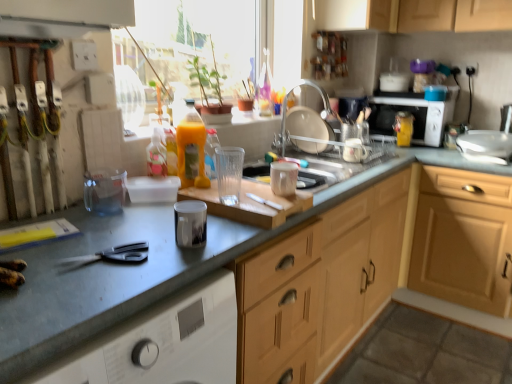
Question: Is the position of translucent plastic bottle at center, acting as the second bottle starting from the front, less distant than that of translucent plastic bottle at center, positioned as the 1th bottle in left-to-right order?

Choices:
 (A) yes
 (B) no

Answer: (B)

Question: From a real-world perspective, is translucent plastic bottle at center, which appears as the 2th bottle when viewed from the back, located beneath translucent plastic bottle at center, the first bottle positioned from the front?

Choices:
 (A) yes
 (B) no

Answer: (A)

Question: From a real-world perspective, is translucent plastic bottle at center, the second bottle from the right, on top of translucent plastic bottle at center, placed as the 3th bottle when sorted from back to front?

Choices:
 (A) no
 (B) yes

Answer: (A)

Question: Is translucent plastic bottle at center, acting as the second bottle starting from the front, to the left of translucent plastic bottle at center, positioned as the 1th bottle in left-to-right order, from the viewer's perspective?

Choices:
 (A) yes
 (B) no

Answer: (B)

Question: Considering the relative positions of translucent plastic bottle at center, acting as the second bottle starting from the front, and translucent plastic bottle at center, positioned as the 1th bottle in left-to-right order, in the image provided, is translucent plastic bottle at center, acting as the second bottle starting from the front, to the right of translucent plastic bottle at center, positioned as the 1th bottle in left-to-right order, from the viewer's perspective?

Choices:
 (A) yes
 (B) no

Answer: (A)

Question: Can you confirm if translucent plastic bottle at center, the second bottle from the left, is bigger than translucent plastic bottle at center, acting as the 3th bottle starting from the right?

Choices:
 (A) no
 (B) yes

Answer: (A)

Question: Is the depth of white plastic knife at center greater than that of matte silver tap at upper center?

Choices:
 (A) yes
 (B) no

Answer: (B)

Question: Is matte silver tap at upper center completely or partially inside white plastic knife at center?

Choices:
 (A) yes
 (B) no

Answer: (B)

Question: Is white plastic knife at center located outside matte silver tap at upper center?

Choices:
 (A) no
 (B) yes

Answer: (B)

Question: From a real-world perspective, is white plastic knife at center on top of matte silver tap at upper center?

Choices:
 (A) yes
 (B) no

Answer: (B)

Question: Are white plastic knife at center and matte silver tap at upper center far apart?

Choices:
 (A) no
 (B) yes

Answer: (B)

Question: Is white plastic knife at center looking in the opposite direction of matte silver tap at upper center?

Choices:
 (A) yes
 (B) no

Answer: (B)

Question: Does matte white cup at center, the 4th appliance from the right, have a larger size compared to black plastic scissors at lower left?

Choices:
 (A) yes
 (B) no

Answer: (A)